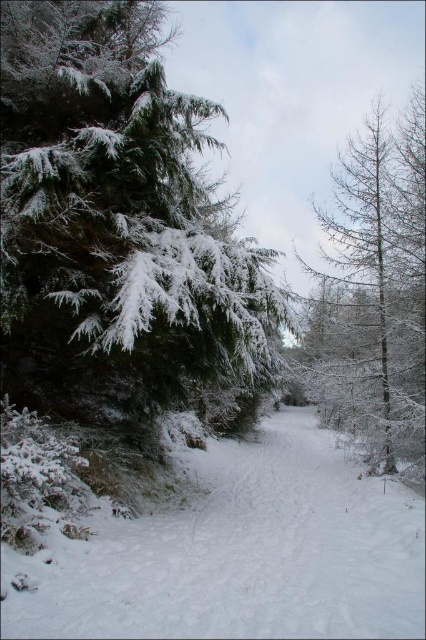
Question: Is white fluffy snow at center above snow-covered larch at right?

Choices:
 (A) yes
 (B) no

Answer: (B)

Question: Is snow-covered evergreen at left above snow-covered larch at right?

Choices:
 (A) no
 (B) yes

Answer: (A)

Question: Is snow-covered evergreen at left above snow-covered larch at right?

Choices:
 (A) yes
 (B) no

Answer: (B)

Question: Which point appears closest to the camera in this image?

Choices:
 (A) (158, 344)
 (B) (405, 435)
 (C) (175, 592)

Answer: (C)

Question: Which object is the farthest from the white fluffy snow at center?

Choices:
 (A) snow-covered evergreen at left
 (B) snow-covered larch at right

Answer: (B)

Question: Based on their relative distances, which object is nearer to the snow-covered larch at right?

Choices:
 (A) white fluffy snow at center
 (B) snow-covered evergreen at left

Answer: (B)